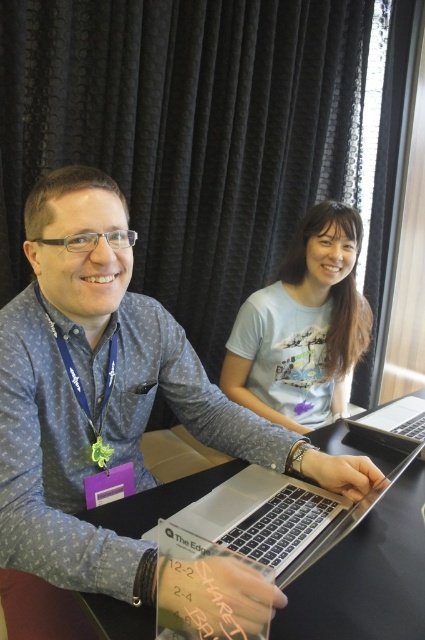
You are standing in front of a table with two people working on laptops. There is a specific point marked at coordinates point (317, 573). If your eyes are 50 inches away from the table, can you see this point clearly?

The distance of point (317, 573) from viewer is 31.34 inches, so yes, you can see it clearly since it is within your 50 inches viewing range.